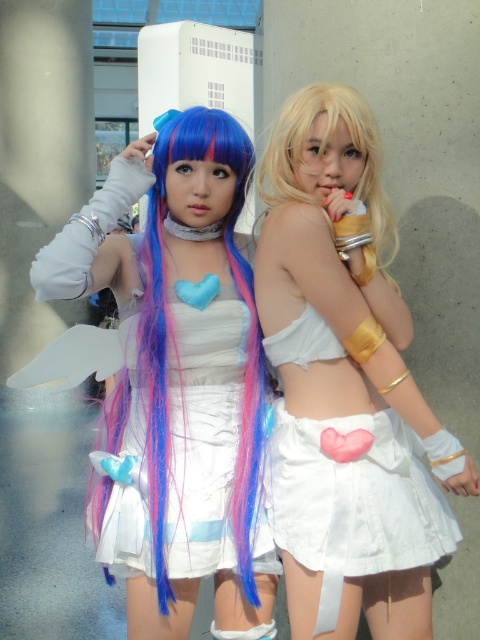
Question: Estimate the real-world distances between objects in this image. Which object is farther from the white matte skirt at center?

Choices:
 (A) matte white dress at center
 (B) blonde silky hair at upper right

Answer: (A)

Question: Does matte white dress at center lie behind blonde silky hair at upper right?

Choices:
 (A) yes
 (B) no

Answer: (B)

Question: Can you confirm if matte white dress at center is positioned below blonde silky hair at upper right?

Choices:
 (A) yes
 (B) no

Answer: (A)

Question: Can you confirm if matte white dress at center is wider than white matte skirt at center?

Choices:
 (A) yes
 (B) no

Answer: (A)

Question: Which object is farther from the camera taking this photo?

Choices:
 (A) white matte skirt at center
 (B) blonde silky hair at upper right

Answer: (B)

Question: Estimate the real-world distances between objects in this image. Which object is closer to the matte white dress at center?

Choices:
 (A) white matte skirt at center
 (B) blonde silky hair at upper right

Answer: (A)